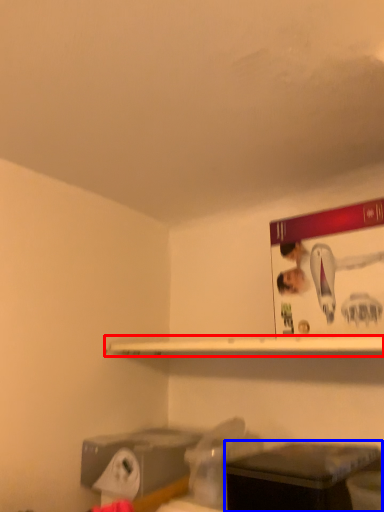
Question: Among these objects, which one is farthest to the camera, shelf (highlighted by a red box) or furniture (highlighted by a blue box)?

Choices:
 (A) shelf
 (B) furniture

Answer: (A)